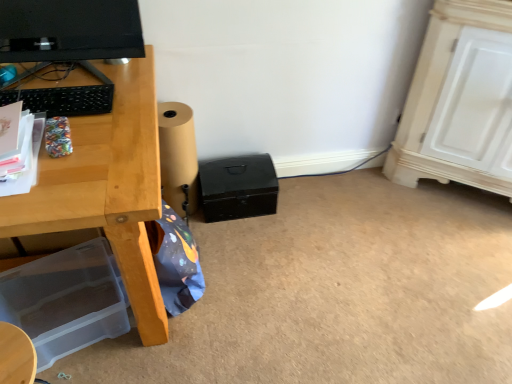
Find the location of a particular element. The image size is (512, 384). black matte box at center, the 1th box when ordered from back to front is located at coordinates (238, 187).

This screenshot has height=384, width=512. Describe the element at coordinates (66, 300) in the screenshot. I see `transparent plastic storage box at lower left, the 2th box viewed from the right` at that location.

Locate an element on the screen. The width and height of the screenshot is (512, 384). matte black monitor at upper left is located at coordinates (69, 30).

Locate an element on the screen. This screenshot has width=512, height=384. black matte box at center, which is counted as the second box, starting from the left is located at coordinates (238, 187).

Considering the relative positions of matte black monitor at upper left and brown paper roll at lower center in the image provided, is matte black monitor at upper left to the right of brown paper roll at lower center from the viewer's perspective?

No.

Does matte black monitor at upper left have a larger size compared to brown paper roll at lower center?

No, matte black monitor at upper left is not bigger than brown paper roll at lower center.

Which object is thinner, matte black monitor at upper left or brown paper roll at lower center?

matte black monitor at upper left is thinner.

Which of these two, transparent plastic storage box at lower left, the second box viewed from the top, or black matte box at center, the 1th box positioned from the top, stands shorter?

Standing shorter between the two is transparent plastic storage box at lower left, the second box viewed from the top.

Is transparent plastic storage box at lower left, which ranks as the second box in back-to-front order, bigger or smaller than black matte box at center, the 1th box when ordered from back to front?

Clearly, transparent plastic storage box at lower left, which ranks as the second box in back-to-front order, is larger in size than black matte box at center, the 1th box when ordered from back to front.

Is transparent plastic storage box at lower left, placed as the first box when sorted from bottom to top, to the left or to the right of black matte box at center, which is the 2th box from front to back, in the image?

In the image, transparent plastic storage box at lower left, placed as the first box when sorted from bottom to top, appears on the left side of black matte box at center, which is the 2th box from front to back.

Is transparent plastic storage box at lower left, placed as the first box when sorted from bottom to top, positioned far away from black matte box at center, the 1th box positioned from the top?

That's not correct — transparent plastic storage box at lower left, placed as the first box when sorted from bottom to top, is a little close to black matte box at center, the 1th box positioned from the top.

Is the depth of transparent plastic storage box at lower left, placed as the 1th box when sorted from front to back, less than that of brown paper roll at lower center?

Yes, transparent plastic storage box at lower left, placed as the 1th box when sorted from front to back, is in front of brown paper roll at lower center.

From the image's perspective, between transparent plastic storage box at lower left, which ranks as the second box in back-to-front order, and brown paper roll at lower center, which one is located above?

brown paper roll at lower center.

Could you measure the distance between transparent plastic storage box at lower left, which ranks as the second box in back-to-front order, and brown paper roll at lower center?

transparent plastic storage box at lower left, which ranks as the second box in back-to-front order, and brown paper roll at lower center are 51.58 centimeters apart from each other.

From their relative heights in the image, would you say brown paper roll at lower center is taller or shorter than transparent plastic storage box at lower left, placed as the first box when sorted from bottom to top?

Considering their sizes, brown paper roll at lower center has more height than transparent plastic storage box at lower left, placed as the first box when sorted from bottom to top.

Where is `box that is on the left side of brown paper roll at lower center`? The width and height of the screenshot is (512, 384). box that is on the left side of brown paper roll at lower center is located at coordinates (66, 300).

Between point (193, 150) and point (41, 342), which one is positioned in front?

The point (41, 342) is more forward.

How many degrees apart are the facing directions of brown paper roll at lower center and transparent plastic storage box at lower left, acting as the first box starting from the left?

The angular difference between brown paper roll at lower center and transparent plastic storage box at lower left, acting as the first box starting from the left, is 20.7 degrees.

Is brown paper roll at lower center further to camera compared to matte black monitor at upper left?

That is True.

Can you confirm if brown paper roll at lower center is thinner than matte black monitor at upper left?

Incorrect, the width of brown paper roll at lower center is not less than that of matte black monitor at upper left.

Considering the relative positions of brown paper roll at lower center and matte black monitor at upper left in the image provided, is brown paper roll at lower center to the right of matte black monitor at upper left from the viewer's perspective?

Yes, brown paper roll at lower center is to the right of matte black monitor at upper left.

Looking at this image, can you tell me how much brown paper roll at lower center and matte black monitor at upper left differ in facing direction?

There is a 7.18-degree angle between the facing directions of brown paper roll at lower center and matte black monitor at upper left.

Based on their sizes in the image, would you say matte black monitor at upper left is bigger or smaller than black matte box at center, which is the 2th box from front to back?

matte black monitor at upper left is smaller than black matte box at center, which is the 2th box from front to back.

Which is closer, (x=41, y=19) or (x=231, y=191)?

Point (x=41, y=19).

How different are the orientations of matte black monitor at upper left and black matte box at center, the first box from the right, in degrees?

5.23 degrees separate the facing orientations of matte black monitor at upper left and black matte box at center, the first box from the right.

Looking at this image, between matte black monitor at upper left and black matte box at center, which is the 2th box from front to back, which one has larger width?

black matte box at center, which is the 2th box from front to back.

From a real-world perspective, is black matte box at center, which is counted as the second box, starting from the left, located beneath brown paper roll at lower center?

Yes, from a real-world perspective, black matte box at center, which is counted as the second box, starting from the left, is beneath brown paper roll at lower center.

What are the coordinates of `speaker in front of the black matte box at center, the 1th box positioned from the top` in the screenshot? It's located at (178, 157).

From the image's perspective, who appears lower, black matte box at center, which is counted as the second box, starting from the left, or brown paper roll at lower center?

black matte box at center, which is counted as the second box, starting from the left, appears lower in the image.

Is black matte box at center, the 1th box when ordered from back to front, placed right next to brown paper roll at lower center?

black matte box at center, the 1th box when ordered from back to front, is not next to brown paper roll at lower center, and they're not touching.

What are the coordinates of `computer monitor above the brown paper roll at lower center (from the image's perspective)` in the screenshot? It's located at (69, 30).

Locate an element on the screen. box lying below the black matte box at center, the first box from the right (from the image's perspective) is located at coordinates (66, 300).

When comparing their distances from matte black monitor at upper left, does brown paper roll at lower center or black matte box at center, the first box from the right, seem further?

black matte box at center, the first box from the right, is positioned further to the anchor matte black monitor at upper left.

Looking at the image, which one is located closer to transparent plastic storage box at lower left, the 2th box viewed from the right, black matte box at center, which is counted as the 2th box, starting from the bottom, or matte black monitor at upper left?

black matte box at center, which is counted as the 2th box, starting from the bottom, lies closer to transparent plastic storage box at lower left, the 2th box viewed from the right, than the other object.

From the image, which object appears to be farther from matte black monitor at upper left, transparent plastic storage box at lower left, placed as the first box when sorted from bottom to top, or brown paper roll at lower center?

transparent plastic storage box at lower left, placed as the first box when sorted from bottom to top, lies further to matte black monitor at upper left than the other object.

From the image, which object appears to be farther from brown paper roll at lower center, black matte box at center, the first box from the right, or matte black monitor at upper left?

matte black monitor at upper left.

Looking at this image, when comparing their distances from transparent plastic storage box at lower left, placed as the first box when sorted from bottom to top, does black matte box at center, which is the 2th box from front to back, or brown paper roll at lower center seem closer?

Based on the image, brown paper roll at lower center appears to be nearer to transparent plastic storage box at lower left, placed as the first box when sorted from bottom to top.

From the picture: Based on their spatial positions, is matte black monitor at upper left or black matte box at center, the 1th box when ordered from back to front, further from brown paper roll at lower center?

Based on the image, matte black monitor at upper left appears to be further to brown paper roll at lower center.

From the image, which object appears to be nearer to black matte box at center, the 1th box when ordered from back to front, transparent plastic storage box at lower left, which ranks as the second box in back-to-front order, or matte black monitor at upper left?

transparent plastic storage box at lower left, which ranks as the second box in back-to-front order, is positioned closer to the anchor black matte box at center, the 1th box when ordered from back to front.

Looking at this image, which object lies nearer to the anchor point black matte box at center, the first box from the right, brown paper roll at lower center or matte black monitor at upper left?

brown paper roll at lower center is positioned closer to the anchor black matte box at center, the first box from the right.

I want to click on speaker between matte black monitor at upper left and black matte box at center, which is the 2th box from front to back, in the front-back direction, so click(178, 157).

Image resolution: width=512 pixels, height=384 pixels. Find the location of `speaker between transparent plastic storage box at lower left, the 2th box viewed from the right, and black matte box at center, which is counted as the 2th box, starting from the bottom, from left to right`. speaker between transparent plastic storage box at lower left, the 2th box viewed from the right, and black matte box at center, which is counted as the 2th box, starting from the bottom, from left to right is located at coordinates (178, 157).

Locate an element on the screen. This screenshot has width=512, height=384. box between matte black monitor at upper left and transparent plastic storage box at lower left, placed as the first box when sorted from bottom to top, vertically is located at coordinates (238, 187).

Where is `speaker between matte black monitor at upper left and transparent plastic storage box at lower left, acting as the first box starting from the left, vertically`? speaker between matte black monitor at upper left and transparent plastic storage box at lower left, acting as the first box starting from the left, vertically is located at coordinates (178, 157).